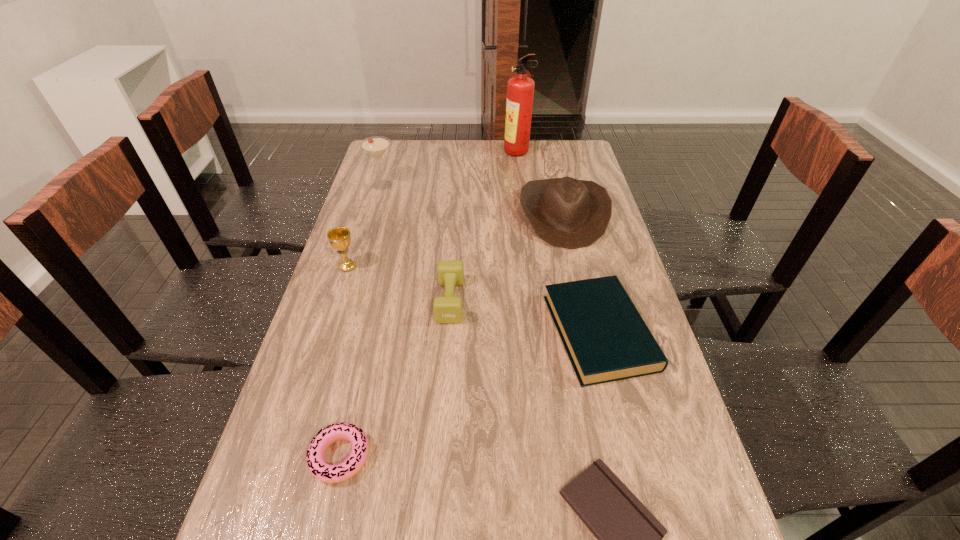
In order to click on fire extinguisher in this screenshot , I will do `click(520, 89)`.

Identify the location of the farthest object. Image resolution: width=960 pixels, height=540 pixels. (520, 89).

Identify the location of martini. The image size is (960, 540). (375, 146).

The image size is (960, 540). Find the location of `cowboy hat`. cowboy hat is located at coordinates (566, 212).

Find the location of `chalice`. chalice is located at coordinates (339, 237).

Identify the location of dumbbell. click(x=447, y=310).

Where is `the fourth object from left to right`? Image resolution: width=960 pixels, height=540 pixels. the fourth object from left to right is located at coordinates (447, 310).

The image size is (960, 540). Identify the location of book. (606, 339).

Find the location of a particular element. Image resolution: width=960 pixels, height=540 pixels. doughnut is located at coordinates point(352,465).

This screenshot has width=960, height=540. In order to click on free space located on the front-facing side of the tallest object in this screenshot , I will do `click(467, 154)`.